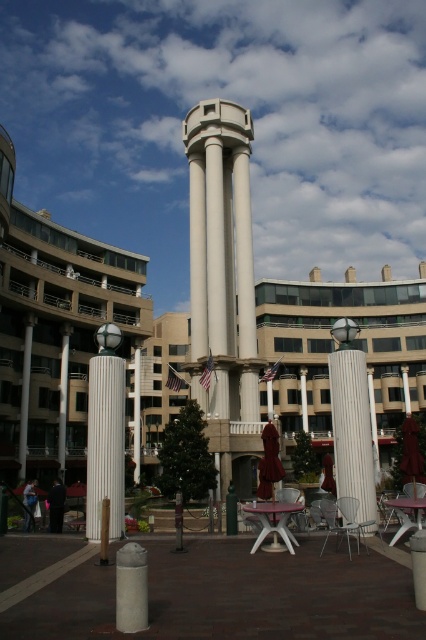
Does gray concrete pillar at lower left appear under blue fabric monk at lower left?

Incorrect, gray concrete pillar at lower left is not positioned below blue fabric monk at lower left.

Between point (129, 586) and point (25, 520), which one is positioned behind?

Positioned behind is point (25, 520).

I want to click on gray concrete pillar at lower left, so click(x=131, y=588).

Which is below, white concrete tower at center or gray concrete pillar at lower left?

Positioned lower is gray concrete pillar at lower left.

Does white concrete tower at center appear on the left side of gray concrete pillar at lower left?

Indeed, white concrete tower at center is positioned on the left side of gray concrete pillar at lower left.

Is point (224, 184) more distant than point (135, 572)?

Yes, point (224, 184) is farther from viewer.

I want to click on white concrete tower at center, so click(224, 284).

Describe the element at coordinates (268, 461) in the screenshot. I see `velvet burgundy robe at center` at that location.

Who is positioned more to the left, velvet burgundy robe at center or metallic silver chair at lower right?

Positioned to the left is velvet burgundy robe at center.

Is point (256, 492) positioned behind point (357, 502)?

Yes, it is.

In order to click on velvet burgundy robe at center in this screenshot , I will do `click(268, 461)`.